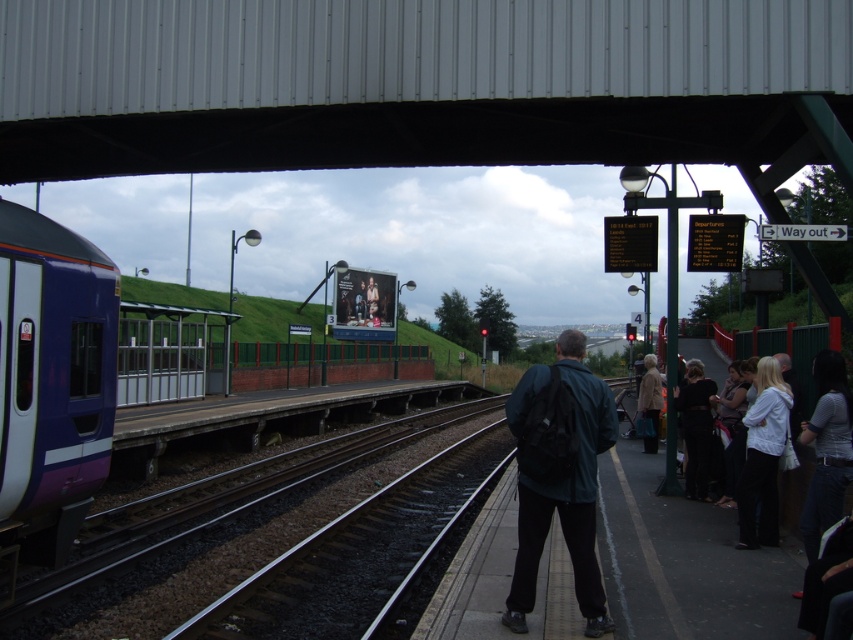
Does metallic gray overpass at upper center appear on the right side of white matte jacket at right?

Incorrect, metallic gray overpass at upper center is not on the right side of white matte jacket at right.

Which is behind, point (318, 45) or point (743, 483)?

Point (318, 45)

Locate an element on the screen. metallic gray overpass at upper center is located at coordinates (415, 83).

Can you confirm if dark green jacket at center is positioned to the left of denim jacket at lower right?

Correct, you'll find dark green jacket at center to the left of denim jacket at lower right.

Who is positioned more to the left, dark green jacket at center or denim jacket at lower right?

From the viewer's perspective, dark green jacket at center appears more on the left side.

You are a GUI agent. You are given a task and a screenshot of the screen. Output one action in this format:
    pyautogui.click(x=<x>, y=<y>)
    Task: Click on the dark green jacket at center
    
    Given the screenshot: What is the action you would take?
    pyautogui.click(x=560, y=476)

Is point (598, 628) positioned in front of point (747, 490)?

Yes.

What do you see at coordinates (560, 476) in the screenshot?
I see `dark green jacket at center` at bounding box center [560, 476].

Is point (602, 632) positioned after point (762, 490)?

No, it is in front of (762, 490).

Locate an element on the screen. Image resolution: width=853 pixels, height=640 pixels. dark green jacket at center is located at coordinates (560, 476).